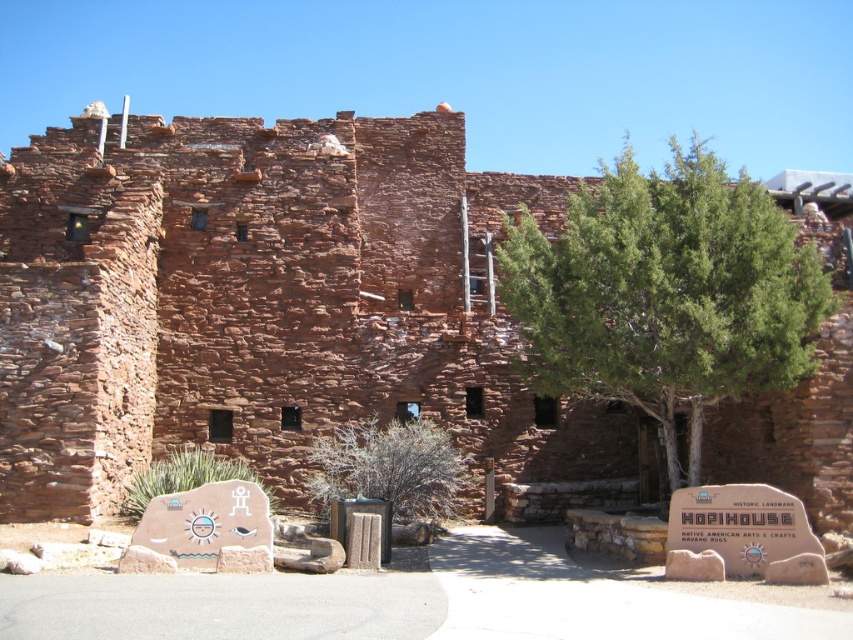
Who is taller, green leafy tree at center or brown textured bush at center?

green leafy tree at center

Who is higher up, green leafy tree at center or brown textured bush at center?

Positioned higher is green leafy tree at center.

The width and height of the screenshot is (853, 640). What do you see at coordinates (665, 296) in the screenshot? I see `green leafy tree at center` at bounding box center [665, 296].

In order to click on green leafy tree at center in this screenshot , I will do `click(665, 296)`.

Which of these two, reddish-brown stone wall at center or brown textured bush at center, stands shorter?

brown textured bush at center

Which is more to the right, reddish-brown stone wall at center or brown textured bush at center?

Positioned to the right is reddish-brown stone wall at center.

Does point (310, 269) come in front of point (317, 493)?

No, it is behind (317, 493).

At what (x,y) coordinates should I click in order to perform the action: click on reddish-brown stone wall at center. Please return your answer as a coordinate pair (x, y). The width and height of the screenshot is (853, 640). Looking at the image, I should click on (262, 304).

Consider the image. Is reddish-brown stone wall at center thinner than green leafy tree at center?

In fact, reddish-brown stone wall at center might be wider than green leafy tree at center.

Is point (837, 484) in front of point (651, 388)?

Yes, it is.

Describe the element at coordinates (262, 304) in the screenshot. I see `reddish-brown stone wall at center` at that location.

Locate an element on the screen. This screenshot has width=853, height=640. reddish-brown stone wall at center is located at coordinates (262, 304).